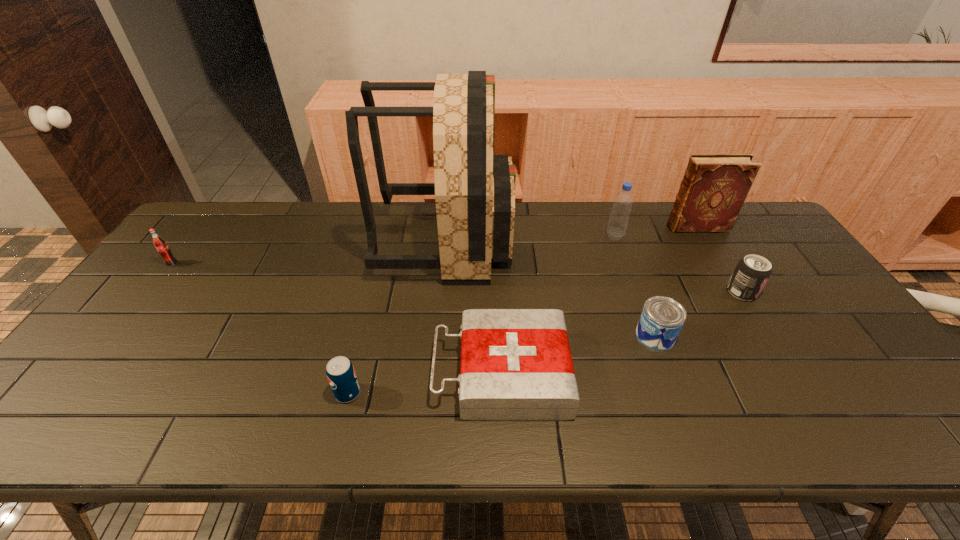
The width and height of the screenshot is (960, 540). I want to click on free region that satisfies the following two spatial constraints: 1. on the front side of the first-aid kit; 2. on the front side of the nearest pop, so click(x=503, y=393).